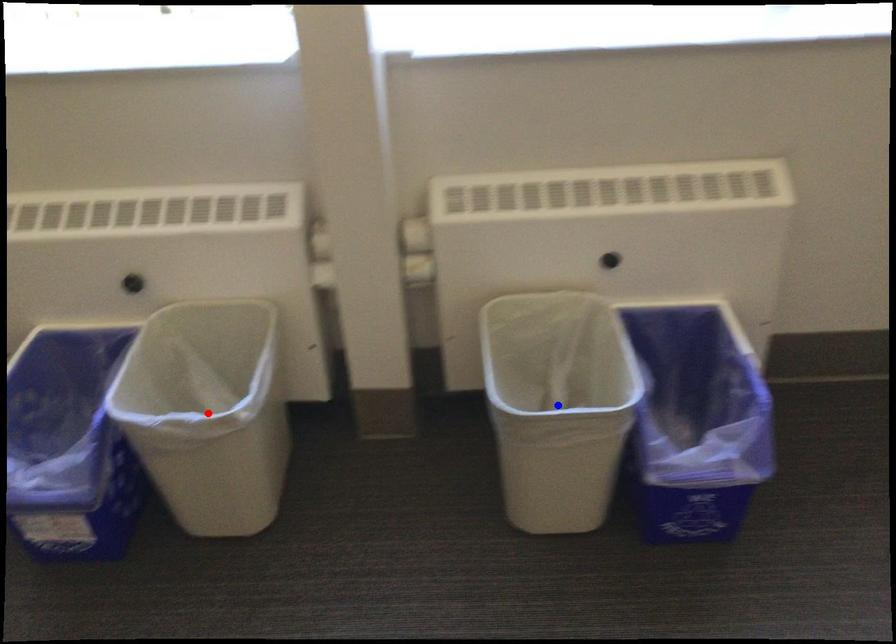
Question: Which of the two points in the image is closer to the camera?

Choices:
 (A) Blue point is closer.
 (B) Red point is closer.

Answer: (B)